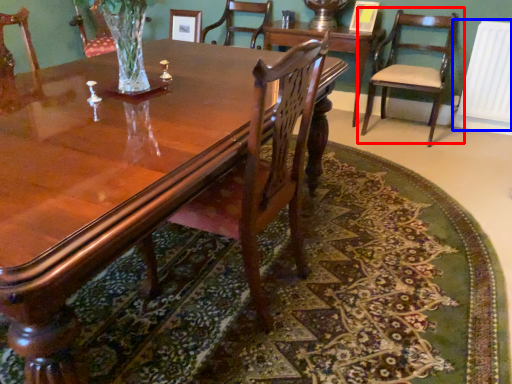
Question: Which of the following is the closest to the observer, chair (highlighted by a red box) or radiator (highlighted by a blue box)?

Choices:
 (A) chair
 (B) radiator

Answer: (A)